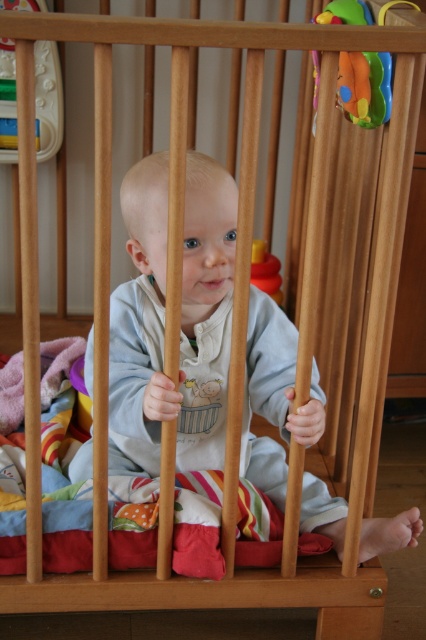
Question: Does rubberized plastic rattle at upper left lie behind rubberized yellow toy at center?

Choices:
 (A) no
 (B) yes

Answer: (A)

Question: Which of the following is the farthest from the observer?

Choices:
 (A) plastic colorful rattle at upper right
 (B) rubberized yellow toy at center
 (C) rubberized plastic rattle at upper left

Answer: (B)

Question: Considering the real-world distances, which object is closest to the rubberized yellow toy at center?

Choices:
 (A) rubberized plastic rattle at upper left
 (B) plastic colorful rattle at upper right

Answer: (B)

Question: Among these objects, which one is nearest to the camera?

Choices:
 (A) rubberized plastic rattle at upper left
 (B) rubberized yellow toy at center

Answer: (A)

Question: Can you confirm if rubberized plastic rattle at upper left is positioned below rubberized yellow toy at center?

Choices:
 (A) yes
 (B) no

Answer: (B)

Question: Is plastic colorful rattle at upper right behind rubberized yellow toy at center?

Choices:
 (A) yes
 (B) no

Answer: (B)